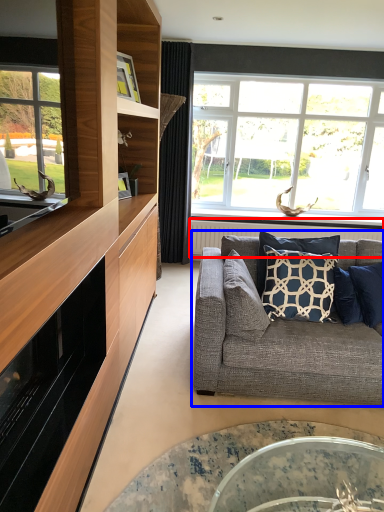
Question: Which of the following is the farthest to the observer, radiator (highlighted by a red box) or studio couch (highlighted by a blue box)?

Choices:
 (A) radiator
 (B) studio couch

Answer: (A)